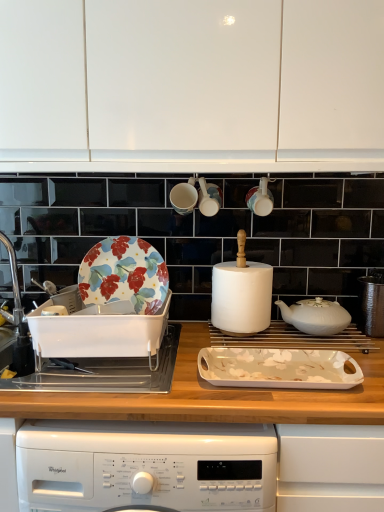
I want to click on white glossy mugs at upper center, which is the 2th appliance in right-to-left order, so click(x=209, y=198).

Measure the distance between wooden at center and camera.

wooden at center is 36.29 inches from camera.

What is the approximate width of white ceramic teapot at center, positioned as the second kitchen appliance in front-to-back order?

The width of white ceramic teapot at center, positioned as the second kitchen appliance in front-to-back order, is 20.96 centimeters.

The width and height of the screenshot is (384, 512). Find the location of `white matte cabinet at upper center`. white matte cabinet at upper center is located at coordinates (192, 85).

The width and height of the screenshot is (384, 512). Describe the element at coordinates (18, 319) in the screenshot. I see `silver metallic sink at left, which is counted as the 1th sink, starting from the left` at that location.

What is the approximate width of silver metallic sink at left, which is the second sink in right-to-left order?

It is 15.28 centimeters.

Image resolution: width=384 pixels, height=512 pixels. What do you see at coordinates (278, 368) in the screenshot? I see `white glossy tray at center, which ranks as the first kitchen appliance in front-to-back order` at bounding box center [278, 368].

You are a GUI agent. You are given a task and a screenshot of the screen. Output one action in this format:
    pyautogui.click(x=<x>, y=<y>)
    Task: Click on the white glossy mugs at upper center, which is the 2th appliance in right-to-left order
    This screenshot has width=384, height=512.
    Given the screenshot: What is the action you would take?
    pyautogui.click(x=209, y=198)

What's the angular difference between wooden at center and white matte paper towel at center's facing directions?

2.05 degrees separate the facing orientations of wooden at center and white matte paper towel at center.

Which of these two, wooden at center or white matte paper towel at center, is thinner?

white matte paper towel at center.

Is wooden at center not close to white matte paper towel at center?

wooden at center is near white matte paper towel at center, not far away.

Consider the image. Could you measure the distance between matte ceramic cup at upper center, the 1th appliance viewed from the right, and white glossy cup at upper center, the third appliance positioned from the right?

21.34 centimeters.

Identify the location of appliance that is the 2nd object directly below the white glossy cup at upper center, the third appliance positioned from the right (from a real-world perspective). (260, 198).

Looking at their sizes, would you say matte ceramic cup at upper center, which is counted as the third appliance, starting from the left, is wider or thinner than white glossy cup at upper center, the third appliance positioned from the right?

matte ceramic cup at upper center, which is counted as the third appliance, starting from the left, is thinner than white glossy cup at upper center, the third appliance positioned from the right.

Consider the image. Who is bigger, white glossy mugs at upper center, which is the second appliance from left to right, or white matte paper towel at center?

white matte paper towel at center is bigger.

Does point (199, 193) come farther from viewer compared to point (236, 273)?

Yes, it is behind point (236, 273).

Is white glossy mugs at upper center, which is the 2th appliance in right-to-left order, not inside white matte paper towel at center?

Absolutely, white glossy mugs at upper center, which is the 2th appliance in right-to-left order, is external to white matte paper towel at center.

From the picture: From the image's perspective, which one is positioned lower, white glossy mugs at upper center, which is the 2th appliance in right-to-left order, or white matte paper towel at center?

white matte paper towel at center is shown below in the image.

Based on the photo, can you tell me how much white glossy tray at center, acting as the 2th kitchen appliance starting from the back, and white glossy mugs at upper center, which is the 2th appliance in right-to-left order, differ in facing direction?

There is a 1.98-degree angle between the facing directions of white glossy tray at center, acting as the 2th kitchen appliance starting from the back, and white glossy mugs at upper center, which is the 2th appliance in right-to-left order.

Based on their sizes in the image, would you say white glossy tray at center, which is the 2th kitchen appliance in top-to-bottom order, is bigger or smaller than white glossy mugs at upper center, which is the 2th appliance in right-to-left order?

In the image, white glossy tray at center, which is the 2th kitchen appliance in top-to-bottom order, appears to be larger than white glossy mugs at upper center, which is the 2th appliance in right-to-left order.

Which is closer to the camera, (218, 362) or (203, 191)?

Point (218, 362) is positioned closer to the camera compared to point (203, 191).

Is white glossy mugs at upper center, which is the second appliance from left to right, completely or partially inside white glossy tray at center, acting as the 2th kitchen appliance starting from the back?

No, white glossy tray at center, acting as the 2th kitchen appliance starting from the back, does not contain white glossy mugs at upper center, which is the second appliance from left to right.

Which object is closer to the camera, white matte cabinet at upper center or white glossy tray at center, which ranks as the first kitchen appliance in front-to-back order?

white glossy tray at center, which ranks as the first kitchen appliance in front-to-back order, is closer to the camera.

Which is closer to the camera, (102, 42) or (327, 369)?

The point (102, 42) is more forward.

Is white glossy tray at center, which ranks as the first kitchen appliance in front-to-back order, surrounded by white matte cabinet at upper center?

Actually, white glossy tray at center, which ranks as the first kitchen appliance in front-to-back order, is outside white matte cabinet at upper center.

From a real-world perspective, between white matte cabinet at upper center and white glossy tray at center, which is counted as the first kitchen appliance, starting from the bottom, who is vertically lower?

white glossy tray at center, which is counted as the first kitchen appliance, starting from the bottom.

From the image's perspective, which one is positioned higher, white ceramic teapot at center, the 2th kitchen appliance in the bottom-to-top sequence, or wooden at center?

white ceramic teapot at center, the 2th kitchen appliance in the bottom-to-top sequence.

Is the depth of white ceramic teapot at center, which is the first kitchen appliance from top to bottom, greater than that of wooden at center?

Yes.

Considering the sizes of objects white ceramic teapot at center, the 2th kitchen appliance in the bottom-to-top sequence, and wooden at center in the image provided, who is thinner, white ceramic teapot at center, the 2th kitchen appliance in the bottom-to-top sequence, or wooden at center?

With smaller width is white ceramic teapot at center, the 2th kitchen appliance in the bottom-to-top sequence.

Which is correct: white matte paper towel at center is inside floral-patterned ceramic plate at left, or outside of it?

white matte paper towel at center is not inside floral-patterned ceramic plate at left, it's outside.

Locate an element on the screen. paper towel located on the right of floral-patterned ceramic plate at left is located at coordinates (241, 296).

Is white matte paper towel at center turned away from floral-patterned ceramic plate at left?

That's not correct — white matte paper towel at center is not looking away from floral-patterned ceramic plate at left.

Is point (217, 320) positioned behind point (146, 298)?

Yes, point (217, 320) is behind point (146, 298).

Identify the location of paper towel on the right of wooden at center. (241, 296).

Find the location of a particular element. the 1st appliance behind the white glossy cup at upper center, acting as the 1th appliance starting from the left, counting from the anchor's position is located at coordinates (260, 198).

When comparing their distances from white ceramic teapot at center, which is counted as the first kitchen appliance, starting from the back, does white glossy mugs at upper center, which is the 2th appliance in right-to-left order, or white matte cabinet at upper center seem further?

white matte cabinet at upper center.

From the image, which object appears to be nearer to white ceramic teapot at center, positioned as the second kitchen appliance in front-to-back order, white glossy cup at upper center, acting as the 1th appliance starting from the left, or white matte paper towel at center?

Based on the image, white matte paper towel at center appears to be nearer to white ceramic teapot at center, positioned as the second kitchen appliance in front-to-back order.

Which object lies nearer to the anchor point floral-patterned ceramic plate at left, matte ceramic cup at upper center, which is counted as the third appliance, starting from the left, or white plastic sink at left, the first sink positioned from the right?

Based on the image, white plastic sink at left, the first sink positioned from the right, appears to be nearer to floral-patterned ceramic plate at left.

Based on their spatial positions, is white ceramic teapot at center, which is counted as the first kitchen appliance, starting from the back, or matte ceramic cup at upper center, which is counted as the third appliance, starting from the left, closer to wooden at center?

The object closer to wooden at center is white ceramic teapot at center, which is counted as the first kitchen appliance, starting from the back.

Estimate the real-world distances between objects in this image. Which object is further from silver metallic sink at left, which is counted as the 1th sink, starting from the left, white glossy cup at upper center, the third appliance positioned from the right, or white ceramic teapot at center, the 2th kitchen appliance in the bottom-to-top sequence?

The object further to silver metallic sink at left, which is counted as the 1th sink, starting from the left, is white ceramic teapot at center, the 2th kitchen appliance in the bottom-to-top sequence.

When comparing their distances from silver metallic sink at left, which is counted as the 1th sink, starting from the left, does floral-patterned ceramic plate at left or white matte cabinet at upper center seem closer?

floral-patterned ceramic plate at left lies closer to silver metallic sink at left, which is counted as the 1th sink, starting from the left, than the other object.

Considering their positions, is floral-patterned ceramic plate at left positioned further to white ceramic teapot at center, which is counted as the first kitchen appliance, starting from the back, than white plastic sink at left, the 2th sink positioned from the left?

white plastic sink at left, the 2th sink positioned from the left.

From the image, which object appears to be farther from wooden at center, white glossy mugs at upper center, which is the 2th appliance in right-to-left order, or floral-patterned ceramic plate at left?

white glossy mugs at upper center, which is the 2th appliance in right-to-left order, lies further to wooden at center than the other object.

In order to click on paper towel between floral-patterned ceramic plate at left and wooden at center from top to bottom in this screenshot , I will do `click(241, 296)`.

I want to click on cabinetry between silver metallic sink at left, which is the second sink in right-to-left order, and white ceramic teapot at center, which is counted as the first kitchen appliance, starting from the back, so click(x=192, y=85).

This screenshot has width=384, height=512. What are the coordinates of `appliance between white glossy mugs at upper center, which is the 2th appliance in right-to-left order, and wooden at center from top to bottom` in the screenshot? It's located at (260, 198).

This screenshot has width=384, height=512. I want to click on countertop located between silver metallic sink at left, which is the second sink in right-to-left order, and white glossy tray at center, which is the 2th kitchen appliance in top-to-bottom order, in the left-right direction, so click(213, 397).